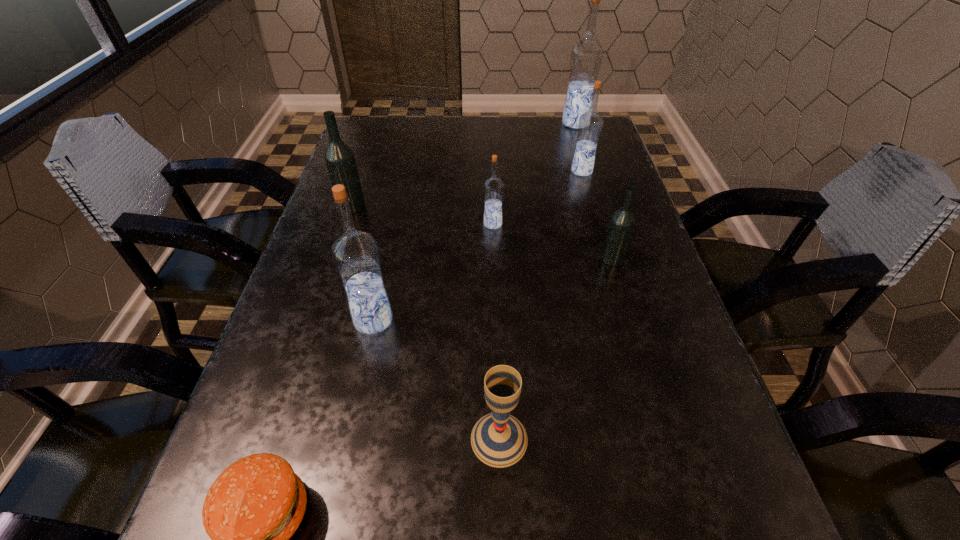
Locate an element on the screen. The height and width of the screenshot is (540, 960). the right black vodka is located at coordinates (622, 222).

This screenshot has width=960, height=540. I want to click on the smaller black vodka, so click(622, 222).

Where is `the seventh farthest object`? This screenshot has width=960, height=540. the seventh farthest object is located at coordinates (498, 439).

Locate an element on the screen. The width and height of the screenshot is (960, 540). chalice is located at coordinates point(498,439).

Locate an element on the screen. vacant space located on the left of the tallest object is located at coordinates (449, 123).

At what (x,y) coordinates should I click in order to perform the action: click on free space located 0.160m on the right of the second vodka from left to right. Please return your answer as a coordinate pair (x, y). This screenshot has width=960, height=540. Looking at the image, I should click on (478, 320).

Identify the location of free region located on the right of the second farthest vodka. Image resolution: width=960 pixels, height=540 pixels. (612, 171).

In order to click on vacant space located 0.100m on the right of the bigger black vodka in this screenshot , I will do `click(406, 206)`.

Find the location of a particular element. vacant space situated 0.380m on the left of the second blue vodka from left to right is located at coordinates (321, 224).

You are a GUI agent. You are given a task and a screenshot of the screen. Output one action in this format:
    pyautogui.click(x=<x>, y=<y>)
    Task: Click on the vacant space located on the back of the fifth farthest vodka
    
    Given the screenshot: What is the action you would take?
    pyautogui.click(x=603, y=227)